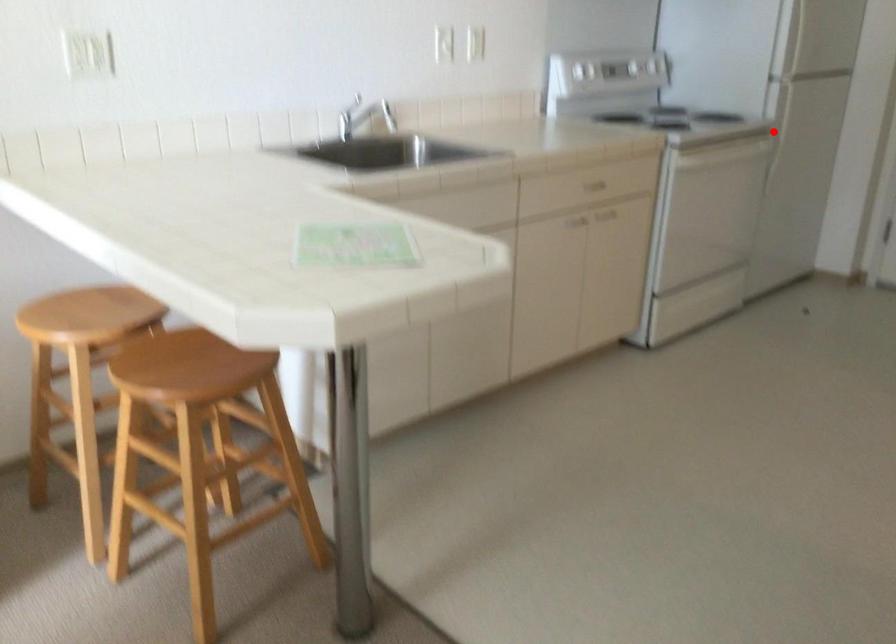
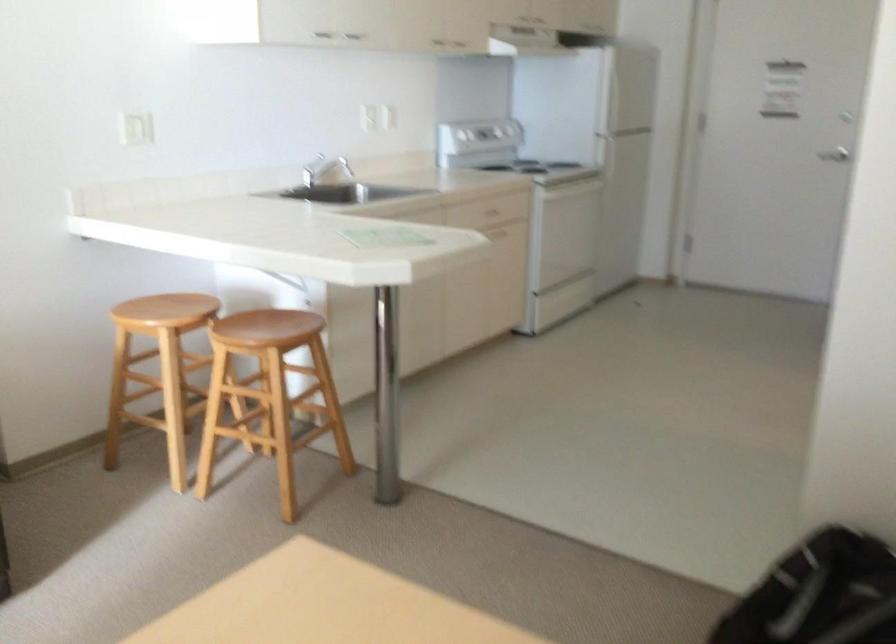
Find the pixel in the second image that matches the highlighted location in the first image.

(606, 164)